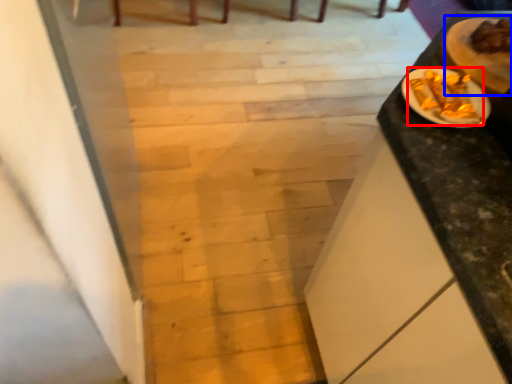
Question: Which point is further to the camera, food (highlighted by a red box) or food (highlighted by a blue box)?

Choices:
 (A) food
 (B) food

Answer: (B)